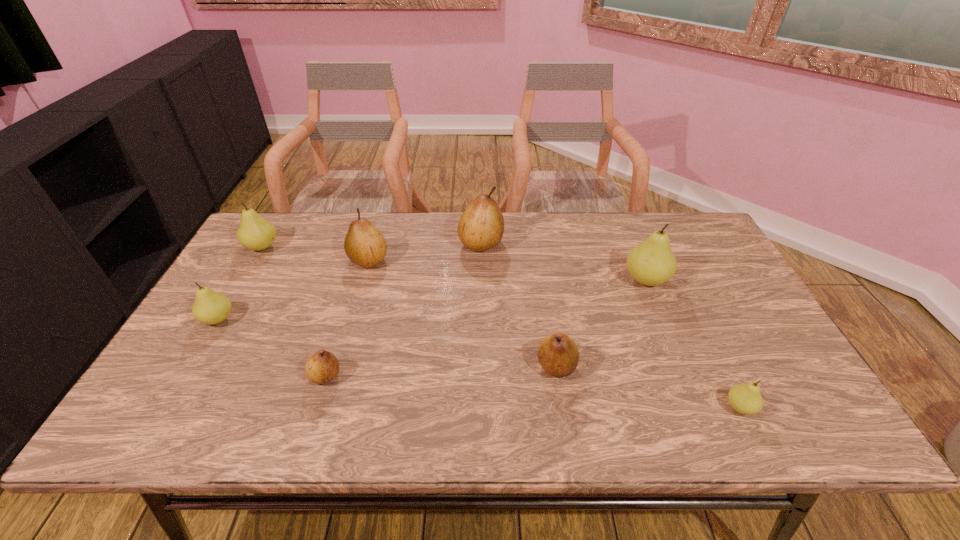
Find the location of a particular element. the nearest green pear is located at coordinates (746, 399).

I want to click on the nearest pear, so click(746, 399).

I want to click on vacant area situated 0.370m on the left of the fifth object from left to right, so click(x=343, y=244).

Locate an element on the screen. This screenshot has height=540, width=960. vacant position located on the back of the third nearest green pear is located at coordinates pos(632,245).

This screenshot has height=540, width=960. Find the location of `free region located 0.320m on the front of the farthest green pear`. free region located 0.320m on the front of the farthest green pear is located at coordinates (208, 339).

You are a GUI agent. You are given a task and a screenshot of the screen. Output one action in this format:
    pyautogui.click(x=<x>, y=<y>)
    Task: Click on the free point located 0.370m on the front of the third smallest brown pear
    
    Given the screenshot: What is the action you would take?
    pyautogui.click(x=334, y=379)

The width and height of the screenshot is (960, 540). In order to click on vacant space situated on the right of the sixth object from left to right in this screenshot , I will do `click(622, 366)`.

The height and width of the screenshot is (540, 960). Find the location of `vacant space situated on the right of the third biggest green pear`. vacant space situated on the right of the third biggest green pear is located at coordinates (254, 319).

At what (x,y) coordinates should I click in order to perform the action: click on blank space located 0.130m on the right of the smallest brown pear. Please return your answer as a coordinate pair (x, y). Image resolution: width=960 pixels, height=540 pixels. Looking at the image, I should click on (396, 376).

You are a GUI agent. You are given a task and a screenshot of the screen. Output one action in this format:
    pyautogui.click(x=<x>, y=<y>)
    Task: Click on the vacant space situated 0.190m on the back of the nearest object
    The image size is (960, 540).
    Given the screenshot: What is the action you would take?
    pyautogui.click(x=702, y=330)